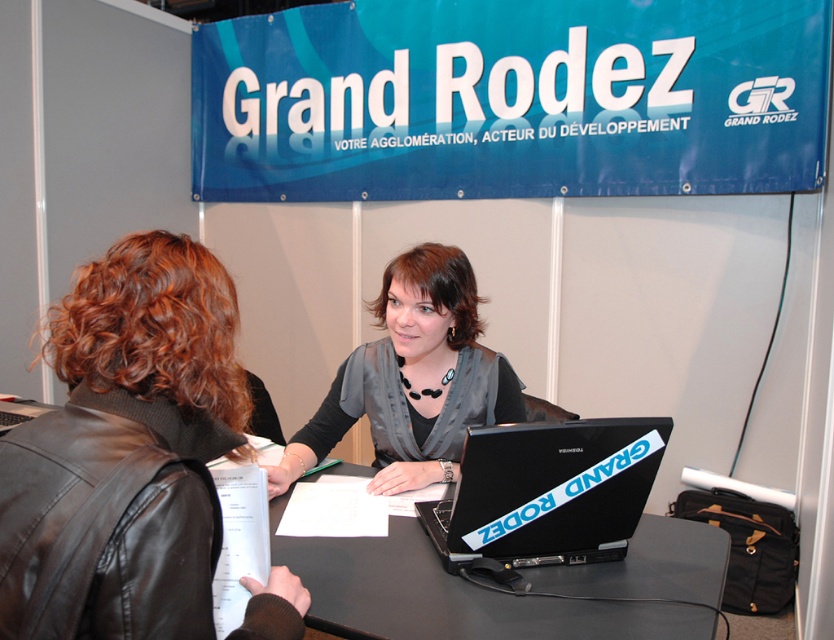
Question: Which point is closer to the camera?

Choices:
 (A) matte gray blouse at center
 (B) black matte table at center
 (C) black leather jacket at upper left

Answer: (C)

Question: In this image, where is black leather jacket at upper left located relative to black matte table at center?

Choices:
 (A) right
 (B) left

Answer: (B)

Question: Does matte gray blouse at center appear over black plastic laptop at center?

Choices:
 (A) no
 (B) yes

Answer: (B)

Question: Does black matte table at center appear over black plastic laptop at center?

Choices:
 (A) no
 (B) yes

Answer: (A)

Question: Which point is farther to the camera?

Choices:
 (A) black leather jacket at upper left
 (B) matte gray blouse at center
 (C) black matte table at center
 (D) black plastic laptop at center

Answer: (B)

Question: Which of these objects is positioned closest to the matte gray blouse at center?

Choices:
 (A) black plastic laptop at center
 (B) black matte table at center

Answer: (B)